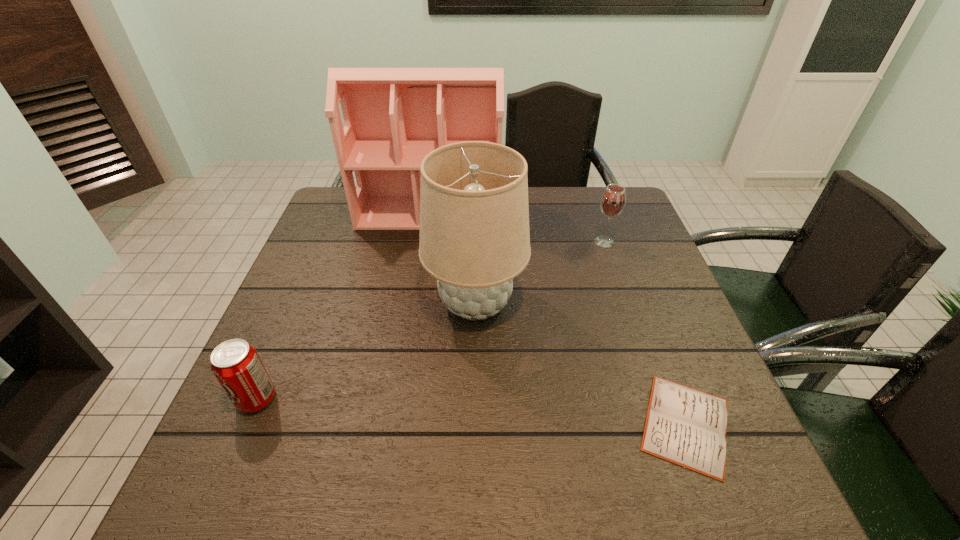
Locate an element on the screen. The height and width of the screenshot is (540, 960). vacant space located on the right of the soda is located at coordinates (396, 399).

At what (x,y) coordinates should I click in order to perform the action: click on free space located 0.300m on the back of the diary. Please return your answer as a coordinate pair (x, y). Looking at the image, I should click on (631, 279).

Where is `object at the far edge`? The image size is (960, 540). object at the far edge is located at coordinates (394, 117).

The width and height of the screenshot is (960, 540). What are the coordinates of `object positioned at the near edge` in the screenshot? It's located at (687, 427).

Find the location of a particular element. Image resolution: width=960 pixels, height=540 pixels. dollhouse present at the left edge is located at coordinates (394, 117).

You are a GUI agent. You are given a task and a screenshot of the screen. Output one action in this format:
    pyautogui.click(x=<x>, y=<y>)
    Task: Click on the soda that is at the left edge
    
    Given the screenshot: What is the action you would take?
    pyautogui.click(x=236, y=364)

Where is `wineglass located in the right edge section of the desktop`? The width and height of the screenshot is (960, 540). wineglass located in the right edge section of the desktop is located at coordinates (613, 200).

Identify the location of diary present at the right edge. (687, 427).

Where is `object situated at the far left corner`? object situated at the far left corner is located at coordinates (394, 117).

Image resolution: width=960 pixels, height=540 pixels. In order to click on object that is at the near right corner in this screenshot , I will do `click(687, 427)`.